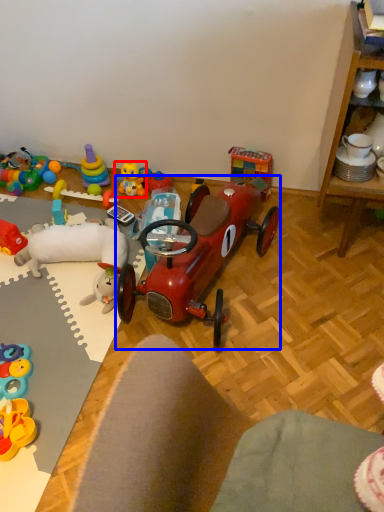
Question: Which of the following is the closest to the observer, toy (highlighted by a red box) or toy (highlighted by a blue box)?

Choices:
 (A) toy
 (B) toy

Answer: (B)